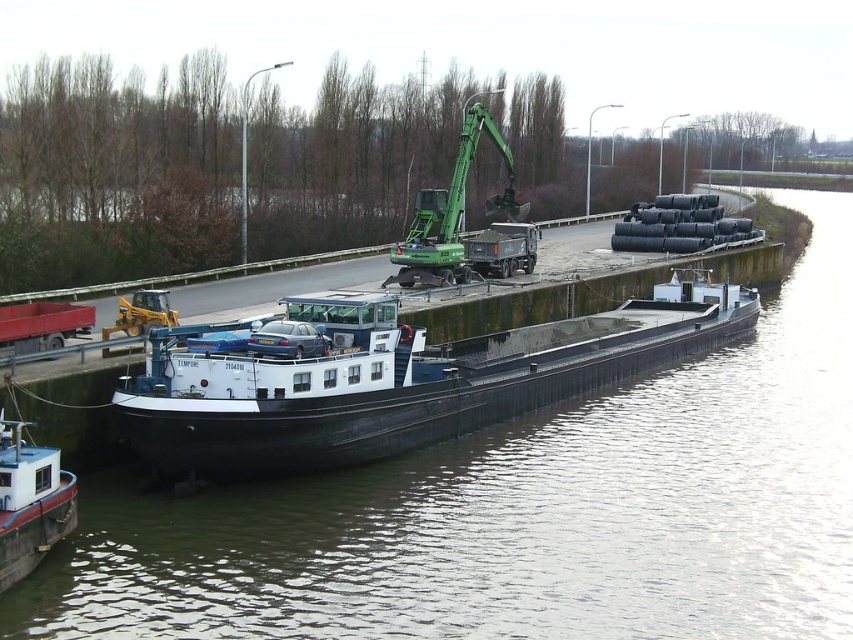
You are a dock worker who needs to load a new shipment of cylindrical pipes onto the barge. The pipes are 2 meters in diameter. You see the black rubber tubes at upper center and the green metallic crane at center. Can the crane safely lift the pipes if the crane can handle objects up to 1.8 meters in diameter?

The black rubber tubes at upper center might be wider than the green metallic crane at center, which has a maximum load diameter of 1.8 meters. Since the pipes are 2 meters in diameter, they exceed the crane capacity, so the crane cannot safely lift them.

You are an engineer inspecting the barge. You need to ensure that the black rubber tubes at upper center are not damaged by the green metallic crane at center. Based on their positions, is there a risk of the crane accidentally hitting the tubes?

The black rubber tubes at upper center are positioned under the green metallic crane at center, so there is a risk of the crane accidentally hitting the tubes.

You are standing at the edge of the canal looking at the barge. There is a specific point marked at coordinates point (x=637, y=490) that you need to reach. If your maximum reach is 20 meters, can you safely reach that point without moving closer?

Result: The point (x=637, y=490) is 25.09 meters away from the viewer. Since your maximum reach is 20 meters, you cannot safely reach that point without moving closer.